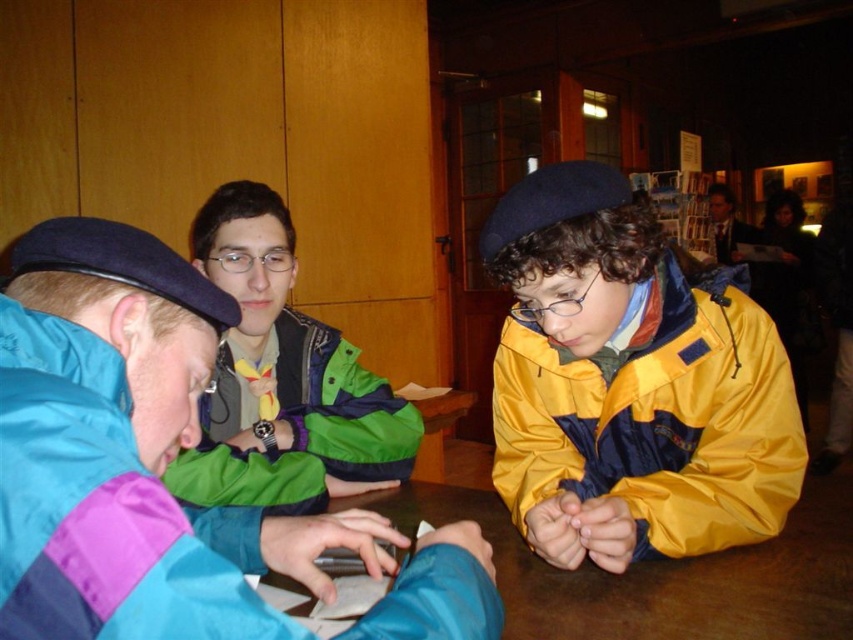
You are organizing a small meeting for four people. The brown wooden table at center is available. Can you fit four chairs around it? Please explain your reasoning based on the table size compared to the formal suit at upper right.

The brown wooden table at center might be wider than the formal suit at upper right. However, since the formal suit at upper right is not a chair, its size cannot be used to determine the table width required for four chairs. More information about the table dimensions or chair sizes is needed to accurately assess if four chairs can fit around the table.

You are sitting at the brown wooden table at center and want to hand a document to the person wearing the yellow matte jacket at center. Since the table is between you and them, can you reach them directly without moving around the table?

The brown wooden table at center is behind the yellow matte jacket at center, so the table is not blocking your direct path. You can reach them directly without moving around the table.

In the scene where three people are sitting at a table with bookshelves and posters in the background, which object is positioned at the coordinates point (296, 426)?

The green matte jacket at center is located at point (296, 426).